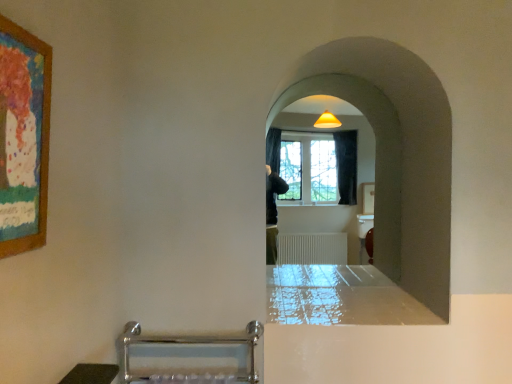
Question: Can white matte wall at center be found inside glossy white counter top at center?

Choices:
 (A) yes
 (B) no

Answer: (B)

Question: Would you say glossy white counter top at center is a long distance from white matte wall at center?

Choices:
 (A) no
 (B) yes

Answer: (A)

Question: From a real-world perspective, is glossy white counter top at center physically above white matte wall at center?

Choices:
 (A) yes
 (B) no

Answer: (B)

Question: Is glossy white counter top at center bigger than white matte wall at center?

Choices:
 (A) no
 (B) yes

Answer: (A)

Question: Are glossy white counter top at center and white matte wall at center beside each other?

Choices:
 (A) no
 (B) yes

Answer: (A)

Question: Considering the relative positions of glossy white counter top at center and wooden painted picture frame at upper left in the image provided, is glossy white counter top at center to the left or to the right of wooden painted picture frame at upper left?

Choices:
 (A) right
 (B) left

Answer: (A)

Question: Is point (394, 286) positioned closer to the camera than point (10, 92)?

Choices:
 (A) farther
 (B) closer

Answer: (A)

Question: Looking at their shapes, would you say glossy white counter top at center is wider or thinner than wooden painted picture frame at upper left?

Choices:
 (A) thin
 (B) wide

Answer: (B)

Question: Is glossy white counter top at center in front of or behind wooden painted picture frame at upper left in the image?

Choices:
 (A) behind
 (B) front

Answer: (A)

Question: Visually, is glossy white counter top at center positioned to the left or to the right of white matte wall at center?

Choices:
 (A) left
 (B) right

Answer: (B)

Question: From the image's perspective, relative to white matte wall at center, is glossy white counter top at center above or below?

Choices:
 (A) below
 (B) above

Answer: (A)

Question: In terms of width, does glossy white counter top at center look wider or thinner when compared to white matte wall at center?

Choices:
 (A) wide
 (B) thin

Answer: (A)

Question: Does point (412, 324) appear closer or farther from the camera than point (435, 127)?

Choices:
 (A) closer
 (B) farther

Answer: (A)

Question: From their relative heights in the image, would you say wooden painted picture frame at upper left is taller or shorter than white matte wall at center?

Choices:
 (A) short
 (B) tall

Answer: (A)

Question: From the image's perspective, is wooden painted picture frame at upper left above or below white matte wall at center?

Choices:
 (A) below
 (B) above

Answer: (B)